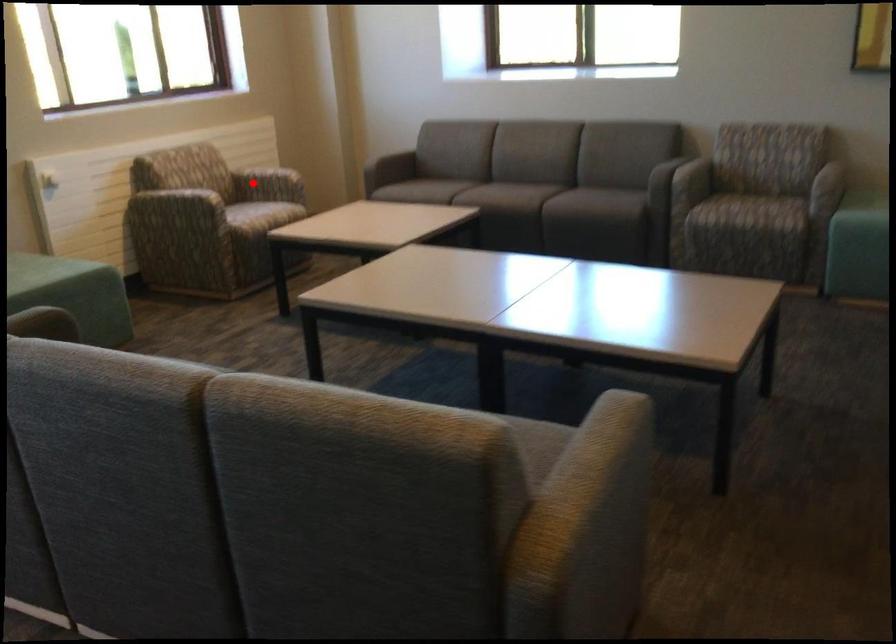
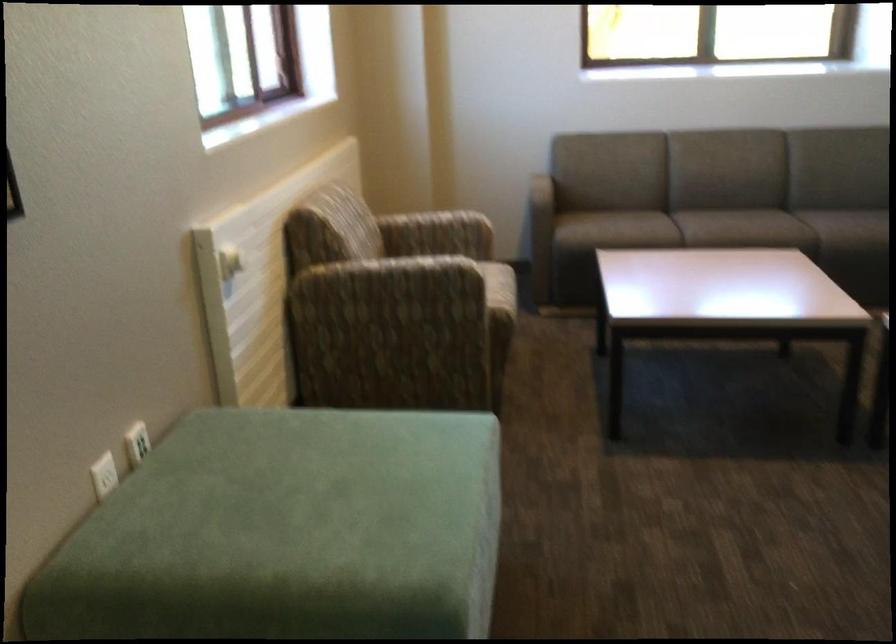
Where in the second image is the point corresponding to the highlighted location from the first image?

(436, 234)